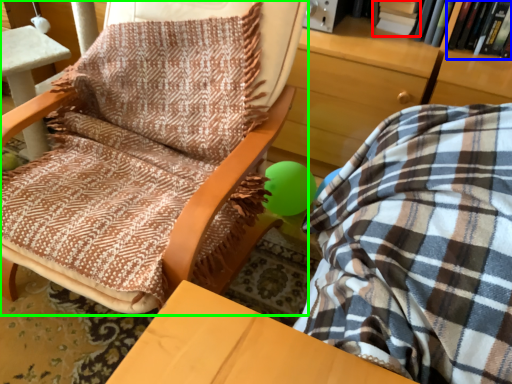
Question: Which object is the farthest from book (highlighted by a red box)? Choose among these: book (highlighted by a blue box) or chair (highlighted by a green box).

Choices:
 (A) book
 (B) chair

Answer: (B)